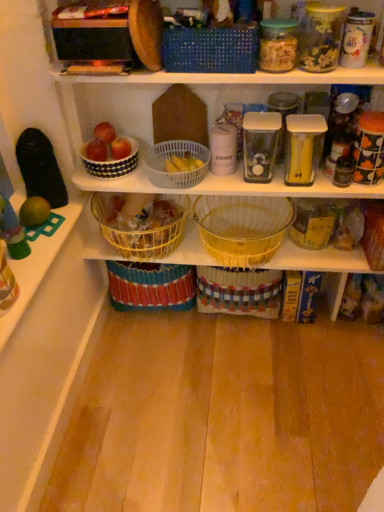
Identify the location of unoccupied area in front of shiny red apple at upper center, positioned as the second apple in left-to-right order. (129, 173).